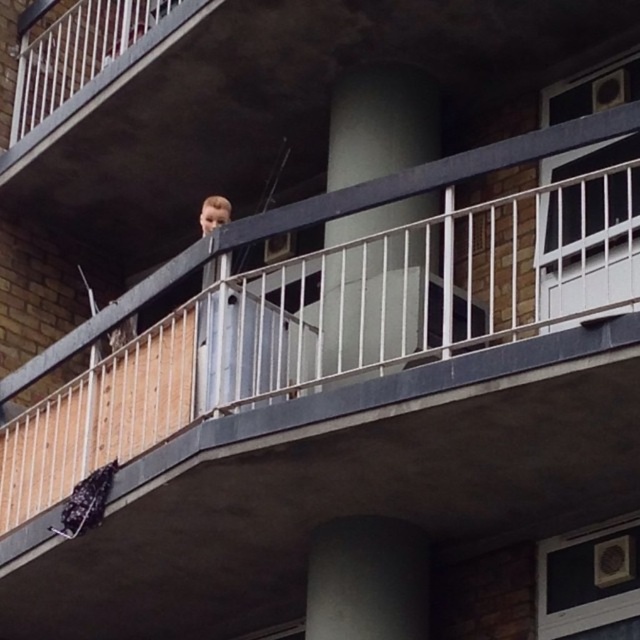
You are standing on the balcony and want to place a small potted plant between the white smooth pillar at center and the blonde hair at center. Given that the plant requires 30 cm of space, is there enough room between them?

The white smooth pillar at center is bigger than blonde hair at center, but the description does not provide specific measurements of the distance between them. Therefore, it is unclear if there is enough space for the plant requiring 30 cm of space.

You are an architect designing a new balcony and want to ensure proper spacing between the white smooth pillar at center and the smooth concrete pillar at center. Which pillar has a greater width according to the scene?

The white smooth pillar at center has a larger width than the smooth concrete pillar at center.

You are standing on the balcony and want to reach the white smooth pillar at center from the blonde hair at center. Which direction should you move in?

To reach the white smooth pillar at center from the blonde hair at center, you should move to the right since the white smooth pillar at center is located to the right of the blonde hair at center.